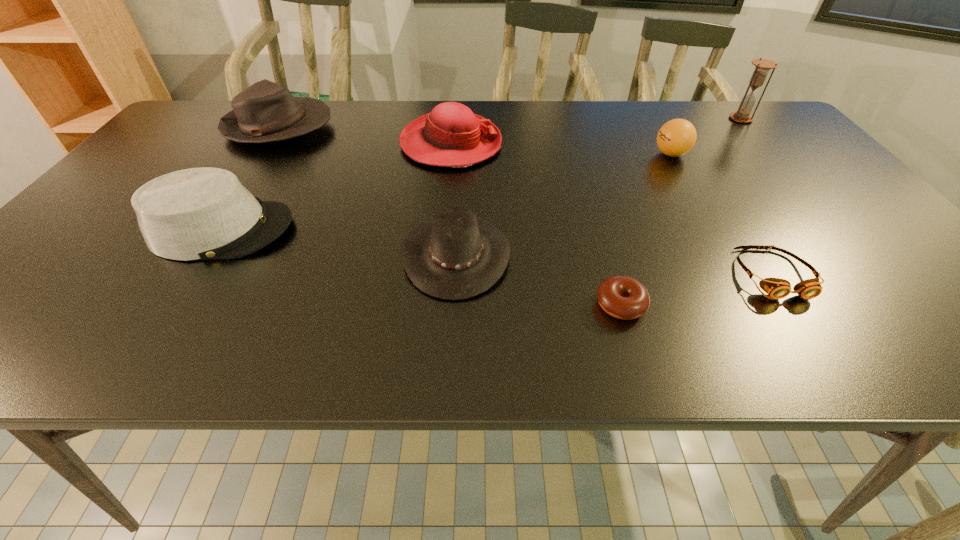
Locate an element on the screen. The height and width of the screenshot is (540, 960). free spot at the near edge of the desktop is located at coordinates (743, 354).

In the image, there is a desktop. Where is `vacant region at the right edge`? The width and height of the screenshot is (960, 540). vacant region at the right edge is located at coordinates (760, 159).

Locate an element on the screen. This screenshot has width=960, height=540. unoccupied position between the rightmost object and the goggles is located at coordinates (756, 196).

Find the location of `vacant space that is in between the shortest hat and the ping-pong ball`. vacant space that is in between the shortest hat and the ping-pong ball is located at coordinates (564, 205).

I want to click on vacant region between the hourglass and the doughnut, so click(681, 212).

The width and height of the screenshot is (960, 540). Identify the location of free space between the rightmost object and the goggles. (756, 196).

This screenshot has height=540, width=960. What are the coordinates of `free space between the hourglass and the ping-pong ball` in the screenshot? It's located at (706, 137).

You are a GUI agent. You are given a task and a screenshot of the screen. Output one action in this format:
    pyautogui.click(x=<x>, y=<y>)
    Task: Click on the vacant space that is in between the shortest hat and the doughnut
    
    Given the screenshot: What is the action you would take?
    tap(539, 280)

The image size is (960, 540). I want to click on empty space that is in between the shortest hat and the goggles, so click(614, 265).

Identify which object is located as the fifth nearest to the fifth object from left to right. Please provide its 2D coordinates. Your answer should be formatted as a tuple, i.e. [(x, y)], where the tuple contains the x and y coordinates of a point satisfying the conditions above.

[(205, 213)]